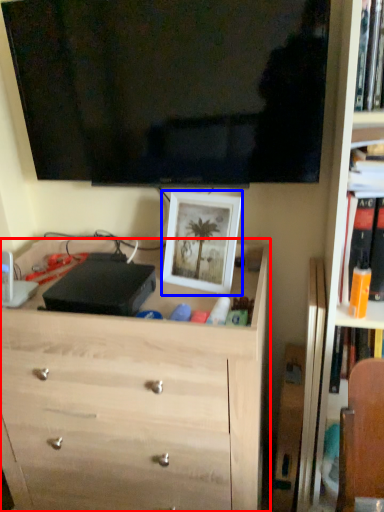
Question: Which object appears closest to the camera in this image, chest of drawers (highlighted by a red box) or picture frame (highlighted by a blue box)?

Choices:
 (A) chest of drawers
 (B) picture frame

Answer: (A)